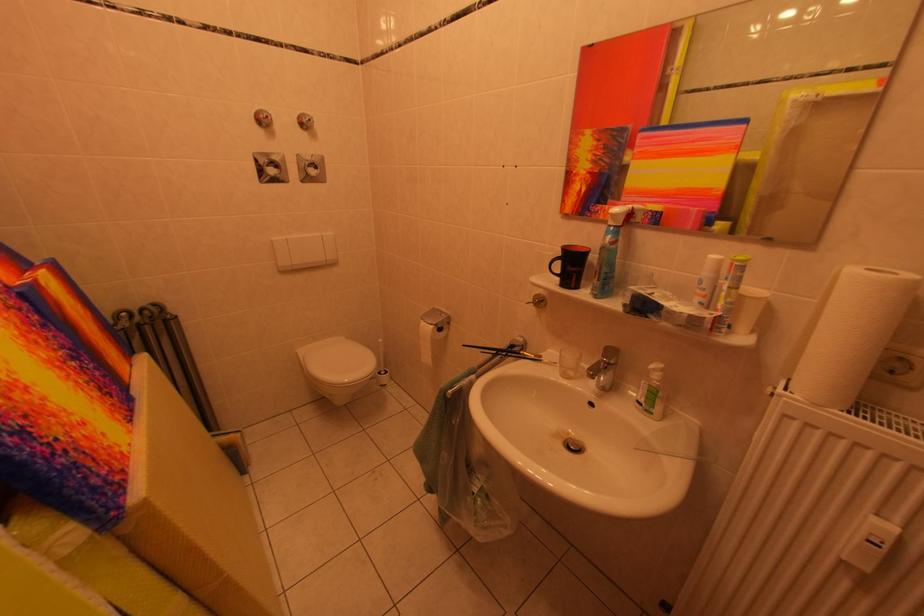
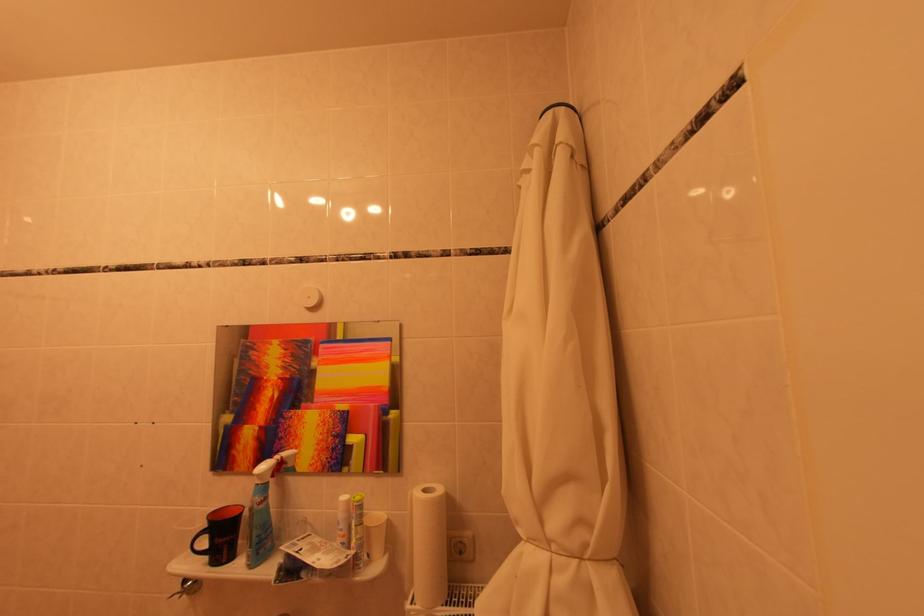
Locate, in the second image, the point that corresponds to [800,397] in the first image.

(423, 608)